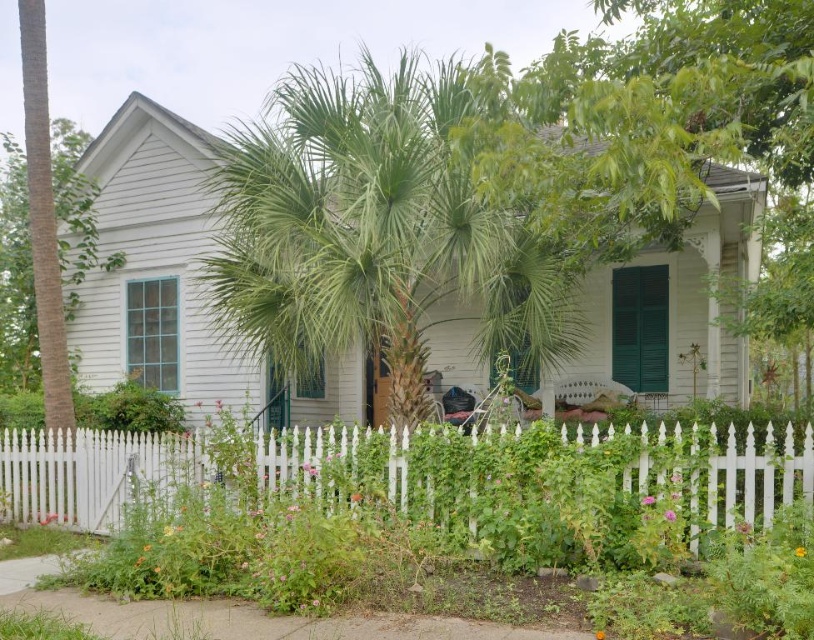
Question: Does white picket fence at lower center appear under green matte window at center?

Choices:
 (A) yes
 (B) no

Answer: (A)

Question: Which point is farther to the camera?

Choices:
 (A) (145, 339)
 (B) (655, 372)

Answer: (A)

Question: Which point is farther to the camera?

Choices:
 (A) white picket fence at lower center
 (B) green matte window at center

Answer: (B)

Question: Where is white picket fence at lower center located in relation to green matte shutters at lower right in the image?

Choices:
 (A) left
 (B) right

Answer: (A)

Question: Can you confirm if green matte shutters at lower right is positioned below green matte window at center?

Choices:
 (A) no
 (B) yes

Answer: (A)

Question: Among these objects, which one is farthest from the camera?

Choices:
 (A) white picket fence at lower center
 (B) green matte shutters at lower right
 (C) green matte window at center

Answer: (C)